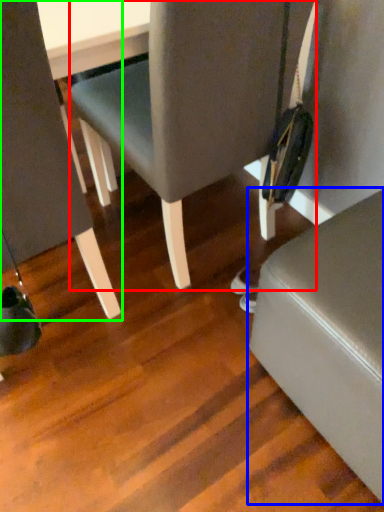
Question: Which object is the farthest from chair (highlighted by a red box)? Choose among these: furniture (highlighted by a blue box) or chair (highlighted by a green box).

Choices:
 (A) furniture
 (B) chair

Answer: (A)